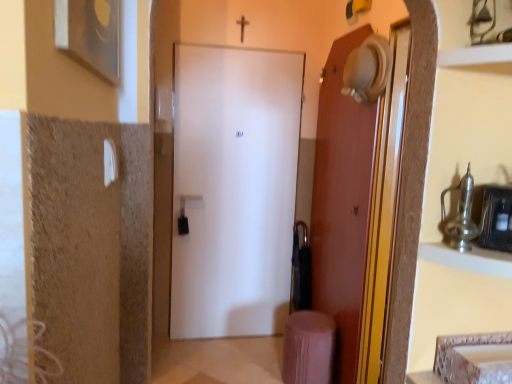
Describe the element at coordinates (308, 348) in the screenshot. The image size is (512, 384). I see `pink fabric stool at lower right` at that location.

What do you see at coordinates (497, 219) in the screenshot? Image resolution: width=512 pixels, height=384 pixels. I see `metallic silver medicine cabinet at right` at bounding box center [497, 219].

Measure the distance between white matte door at center, the 1th door in the left-to-right sequence, and camera.

The depth of white matte door at center, the 1th door in the left-to-right sequence, is 2.73 meters.

Image resolution: width=512 pixels, height=384 pixels. I want to click on white matte door at center, the 1th door in the left-to-right sequence, so click(234, 189).

What is the approximate width of metallic silver cabinet at upper right?

metallic silver cabinet at upper right is 9.81 inches wide.

At what (x,y) coordinates should I click in order to perform the action: click on metallic silver shelf at upper right. Please return your answer as a coordinate pair (x, y). The width and height of the screenshot is (512, 384). Looking at the image, I should click on (478, 58).

Can you confirm if metallic silver cabinet at upper right is shorter than pink fabric stool at lower right?

Yes, metallic silver cabinet at upper right is shorter than pink fabric stool at lower right.

Is metallic silver cabinet at upper right facing away from pink fabric stool at lower right?

No, metallic silver cabinet at upper right's orientation is not away from pink fabric stool at lower right.

Is metallic silver cabinet at upper right wider or thinner than pink fabric stool at lower right?

Clearly, metallic silver cabinet at upper right has less width compared to pink fabric stool at lower right.

Considering the sizes of objects metallic silver shelf at upper right and matte brown door at right, the second door viewed from the left, in the image provided, who is smaller, metallic silver shelf at upper right or matte brown door at right, the second door viewed from the left,?

metallic silver shelf at upper right.

Does point (463, 63) lie in front of point (324, 249)?

Yes, it is in front of point (324, 249).

From the image's perspective, is metallic silver shelf at upper right on matte brown door at right, the first door when ordered from right to left?

Yes, from the image's perspective, metallic silver shelf at upper right is above matte brown door at right, the first door when ordered from right to left.

Can you confirm if metallic silver shelf at upper right is wider than matte brown door at right, the first door when ordered from right to left?

Yes, metallic silver shelf at upper right is wider than matte brown door at right, the first door when ordered from right to left.

From a real-world perspective, which object rests below the other?

matte brown door at right, the second door viewed from the left.

I want to click on door that is the 1st one when counting upward from the metallic silver cabinet at upper right (from the image's perspective), so click(x=342, y=204).

Is metallic silver cabinet at upper right to the right of matte brown door at right, the second door viewed from the left, from the viewer's perspective?

Yes, metallic silver cabinet at upper right is to the right of matte brown door at right, the second door viewed from the left.

Considering the sizes of objects matte brown door at right, the second door viewed from the left, and pink fabric stool at lower right in the image provided, who is bigger, matte brown door at right, the second door viewed from the left, or pink fabric stool at lower right?

matte brown door at right, the second door viewed from the left.

Which is behind, matte brown door at right, the second door viewed from the left, or pink fabric stool at lower right?

pink fabric stool at lower right is more distant.

Is matte brown door at right, the first door when ordered from right to left, taller than pink fabric stool at lower right?

Yes.

In the scene shown: Would you say matte brown door at right, the first door when ordered from right to left, is inside or outside pink fabric stool at lower right?

matte brown door at right, the first door when ordered from right to left, lies outside pink fabric stool at lower right.

How different are the orientations of white matte door at center, which appears as the second door when viewed from the right, and metallic silver cabinet at upper right in degrees?

The angular difference between white matte door at center, which appears as the second door when viewed from the right, and metallic silver cabinet at upper right is 0.222 degrees.

Can you confirm if white matte door at center, which appears as the second door when viewed from the right, is shorter than metallic silver cabinet at upper right?

In fact, white matte door at center, which appears as the second door when viewed from the right, may be taller than metallic silver cabinet at upper right.

Considering the sizes of white matte door at center, the 1th door in the left-to-right sequence, and metallic silver cabinet at upper right in the image, is white matte door at center, the 1th door in the left-to-right sequence, wider or thinner than metallic silver cabinet at upper right?

Clearly, white matte door at center, the 1th door in the left-to-right sequence, has less width compared to metallic silver cabinet at upper right.

Can you confirm if white matte door at center, the 1th door in the left-to-right sequence, is positioned to the right of metallic silver cabinet at upper right?

In fact, white matte door at center, the 1th door in the left-to-right sequence, is to the left of metallic silver cabinet at upper right.

From the image's perspective, relative to white matte door at center, the 1th door in the left-to-right sequence, is metallic silver cabinet at upper right above or below?

metallic silver cabinet at upper right is situated lower than white matte door at center, the 1th door in the left-to-right sequence, in the image.

Between point (475, 265) and point (216, 284), which one is positioned in front?

Positioned in front is point (475, 265).

Is metallic silver cabinet at upper right not near white matte door at center, the 1th door in the left-to-right sequence?

Absolutely, metallic silver cabinet at upper right is distant from white matte door at center, the 1th door in the left-to-right sequence.

From a real-world perspective, is metallic silver cabinet at upper right below white matte door at center, which appears as the second door when viewed from the right?

No, from a real-world perspective, metallic silver cabinet at upper right is not below white matte door at center, which appears as the second door when viewed from the right.

Between metallic silver shelf at upper right and pink fabric stool at lower right, which one appears on the left side from the viewer's perspective?

pink fabric stool at lower right is more to the left.

Considering the sizes of metallic silver shelf at upper right and pink fabric stool at lower right in the image, is metallic silver shelf at upper right wider or thinner than pink fabric stool at lower right?

metallic silver shelf at upper right is thinner than pink fabric stool at lower right.

From a real-world perspective, is metallic silver shelf at upper right located beneath pink fabric stool at lower right?

No, from a real-world perspective, metallic silver shelf at upper right is not under pink fabric stool at lower right.

Can you tell me how much metallic silver shelf at upper right and pink fabric stool at lower right differ in facing direction?

The angle between the facing direction of metallic silver shelf at upper right and the facing direction of pink fabric stool at lower right is 2.11 degrees.

At what (x,y) coordinates should I click in order to perform the action: click on cabinet above the pink fabric stool at lower right (from a real-world perspective). Please return your answer as a coordinate pair (x, y). The image size is (512, 384). Looking at the image, I should click on point(468,259).

Identify the location of shelf in front of the matte brown door at right, the second door viewed from the left. (478, 58).

Which object lies further to the anchor point matte brown door at right, the second door viewed from the left, white matte door at center, the 1th door in the left-to-right sequence, or pink fabric stool at lower right?

white matte door at center, the 1th door in the left-to-right sequence, lies further to matte brown door at right, the second door viewed from the left, than the other object.

When comparing their distances from white matte door at center, the 1th door in the left-to-right sequence, does pink fabric stool at lower right or metallic silver medicine cabinet at right seem further?

metallic silver medicine cabinet at right is positioned further to the anchor white matte door at center, the 1th door in the left-to-right sequence.

From the image, which object appears to be nearer to matte brown door at right, the second door viewed from the left, metallic silver cabinet at upper right or metallic silver medicine cabinet at right?

Among the two, metallic silver cabinet at upper right is located nearer to matte brown door at right, the second door viewed from the left.

From the image, which object appears to be nearer to pink fabric stool at lower right, metallic silver cabinet at upper right or white matte door at center, the 1th door in the left-to-right sequence?

white matte door at center, the 1th door in the left-to-right sequence, lies closer to pink fabric stool at lower right than the other object.

Looking at the image, which one is located further to metallic silver cabinet at upper right, pink fabric stool at lower right or matte brown door at right, the first door when ordered from right to left?

The object further to metallic silver cabinet at upper right is pink fabric stool at lower right.

Looking at the image, which one is located closer to pink fabric stool at lower right, metallic silver medicine cabinet at right or matte brown door at right, the first door when ordered from right to left?

matte brown door at right, the first door when ordered from right to left, is positioned closer to the anchor pink fabric stool at lower right.

When comparing their distances from metallic silver cabinet at upper right, does metallic silver shelf at upper right or matte brown door at right, the first door when ordered from right to left, seem closer?

metallic silver shelf at upper right is positioned closer to the anchor metallic silver cabinet at upper right.

From the picture: Which object lies nearer to the anchor point white matte door at center, the 1th door in the left-to-right sequence, metallic silver medicine cabinet at right or metallic silver cabinet at upper right?

metallic silver cabinet at upper right is positioned closer to the anchor white matte door at center, the 1th door in the left-to-right sequence.

Image resolution: width=512 pixels, height=384 pixels. I want to click on medicine cabinet between metallic silver cabinet at upper right and matte brown door at right, the second door viewed from the left, from front to back, so click(x=497, y=219).

I want to click on medicine cabinet located between metallic silver shelf at upper right and white matte door at center, the 1th door in the left-to-right sequence, in the depth direction, so click(x=497, y=219).

Locate an element on the screen. The image size is (512, 384). cabinet located between metallic silver shelf at upper right and pink fabric stool at lower right in the depth direction is located at coordinates (468, 259).

Locate an element on the screen. This screenshot has height=384, width=512. door between metallic silver shelf at upper right and white matte door at center, the 1th door in the left-to-right sequence, from front to back is located at coordinates click(342, 204).